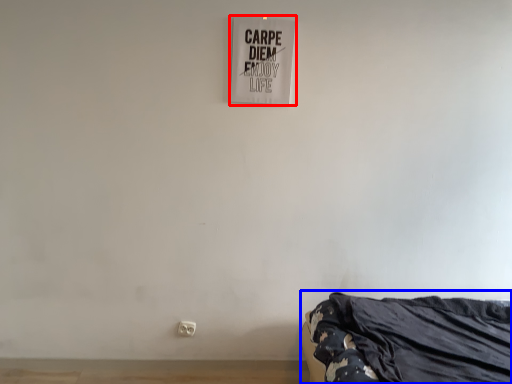
Question: Which point is further to the camera, signage (highlighted by a red box) or furniture (highlighted by a blue box)?

Choices:
 (A) signage
 (B) furniture

Answer: (A)